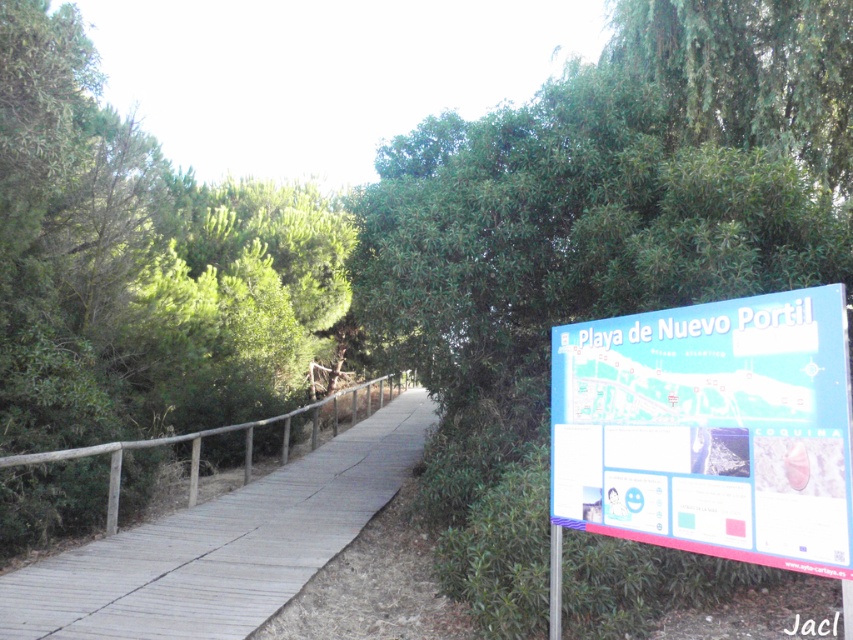
Does green leafy tree at left have a greater width compared to wooden at left?

No, green leafy tree at left is not wider than wooden at left.

Is green leafy tree at left further to camera compared to wooden at left?

Yes, green leafy tree at left is behind wooden at left.

This screenshot has height=640, width=853. Identify the location of green leafy tree at left. (138, 264).

Between green leafy tree at upper right and green leafy tree at left, which one is positioned lower?

green leafy tree at upper right is lower down.

Does green leafy tree at upper right appear over green leafy tree at left?

Actually, green leafy tree at upper right is below green leafy tree at left.

Who is more forward, (581, 236) or (84, 227)?

Point (581, 236)

Where is `green leafy tree at upper right`? This screenshot has height=640, width=853. green leafy tree at upper right is located at coordinates (595, 241).

Is green leafy tree at left wider than blue plastic sign at right?

Correct, the width of green leafy tree at left exceeds that of blue plastic sign at right.

Can you confirm if green leafy tree at left is positioned to the right of blue plastic sign at right?

In fact, green leafy tree at left is to the left of blue plastic sign at right.

Locate an element on the screen. Image resolution: width=853 pixels, height=640 pixels. green leafy tree at left is located at coordinates (138, 264).

Where is `green leafy tree at left`? Image resolution: width=853 pixels, height=640 pixels. green leafy tree at left is located at coordinates (138, 264).